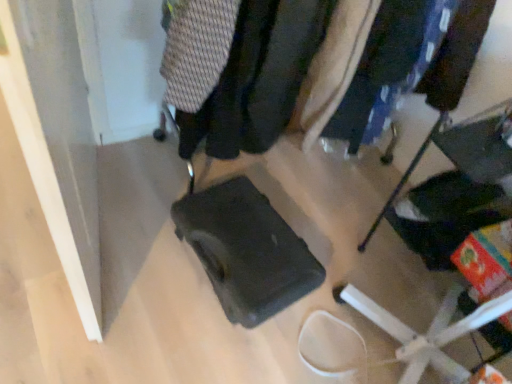
Find the location of a particular element. The width and height of the screenshot is (512, 384). vacant space behind matte black suitcase at center is located at coordinates (362, 248).